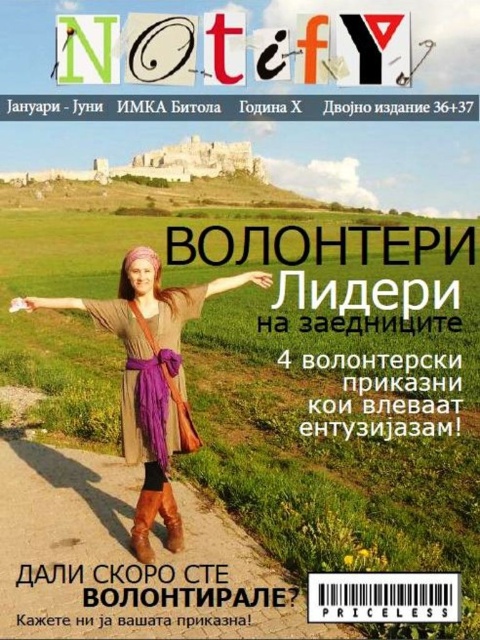
Is brown leather boots at lower center wider than brown suede boot at lower center?

Yes.

Can you confirm if brown leather boots at lower center is bigger than brown suede boot at lower center?

Correct, brown leather boots at lower center is larger in size than brown suede boot at lower center.

Between point (191, 440) and point (144, 496), which one is positioned in front?

Point (144, 496)

Where is `brown leather boots at lower center`? The height and width of the screenshot is (640, 480). brown leather boots at lower center is located at coordinates (152, 355).

Is brown suede boot at lower center bigger than brown leather boot at lower center?

Incorrect, brown suede boot at lower center is not larger than brown leather boot at lower center.

From the picture: Between brown suede boot at lower center and brown leather boot at lower center, which one has more height?

With more height is brown leather boot at lower center.

Between point (135, 554) and point (178, 538), which one is positioned in front?

Point (135, 554) is in front.

Locate an element on the screen. The height and width of the screenshot is (640, 480). brown suede boot at lower center is located at coordinates (144, 524).

Is brown leather boots at lower center thinner than purple fabric arm at center?

Incorrect, brown leather boots at lower center's width is not less than purple fabric arm at center's.

Who is shorter, brown leather boots at lower center or purple fabric arm at center?

purple fabric arm at center

Measure the distance between brown leather boots at lower center and camera.

brown leather boots at lower center is 55.45 meters from camera.

Find the location of a particular element. The height and width of the screenshot is (640, 480). brown leather boots at lower center is located at coordinates (152, 355).